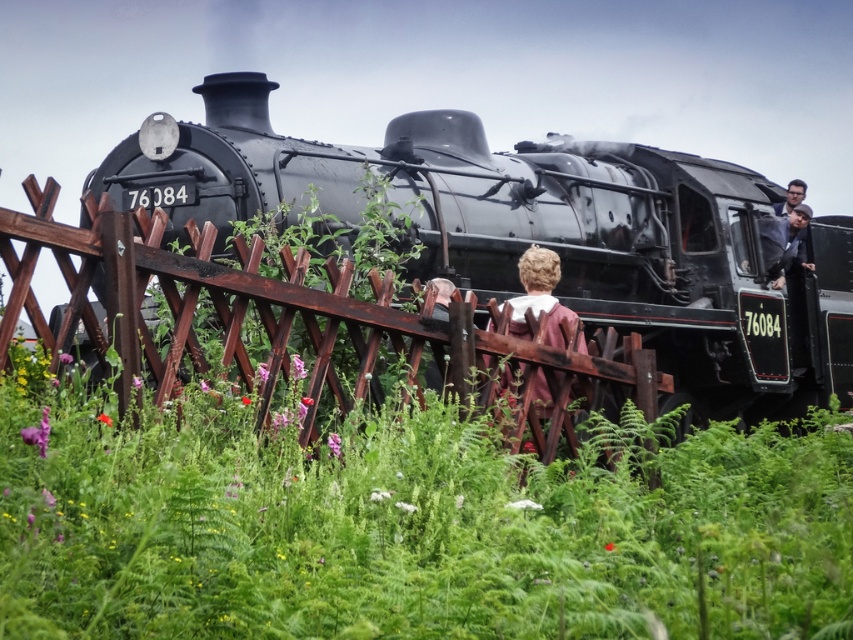
Question: Estimate the real-world distances between objects in this image. Which object is farther from the brown wooden fence at center?

Choices:
 (A) smooth brown hair at upper right
 (B) dark gray suit at upper right
 (C) green leafy grass at center
 (D) brown leather jacket at center

Answer: (A)

Question: Does green leafy grass at center lie behind smooth brown hair at upper right?

Choices:
 (A) yes
 (B) no

Answer: (B)

Question: Which object is closer to the camera taking this photo?

Choices:
 (A) green leafy grass at center
 (B) smooth brown hair at upper right
 (C) dark gray suit at upper right
 (D) brown leather jacket at center

Answer: (A)

Question: Which of the following is the farthest from the observer?

Choices:
 (A) smooth brown hair at upper right
 (B) dark gray suit at upper right

Answer: (A)

Question: From the image, what is the correct spatial relationship of brown leather jacket at center in relation to dark gray suit at upper right?

Choices:
 (A) right
 (B) left

Answer: (B)

Question: In this image, where is dark gray suit at upper right located relative to smooth brown hair at upper right?

Choices:
 (A) right
 (B) left

Answer: (B)